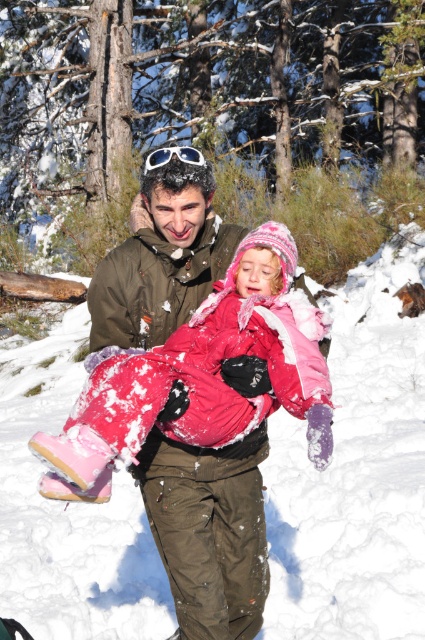
Question: Which of these objects is positioned farthest from the white matte goggles at upper center?

Choices:
 (A) white fluffy snow at center
 (B) fluffy pink snowsuit at center

Answer: (A)

Question: Estimate the real-world distances between objects in this image. Which object is closer to the white matte goggles at upper center?

Choices:
 (A) fluffy pink snowsuit at center
 (B) white fluffy snow at center

Answer: (A)

Question: Is white fluffy snow at center bigger than white matte goggles at upper center?

Choices:
 (A) yes
 (B) no

Answer: (B)

Question: Which of the following is the closest to the observer?

Choices:
 (A) (192, 157)
 (B) (22, 486)

Answer: (A)

Question: Does white fluffy snow at center come behind fluffy pink snowsuit at center?

Choices:
 (A) no
 (B) yes

Answer: (B)

Question: In this image, where is white fluffy snow at center located relative to fluffy pink snowsuit at center?

Choices:
 (A) right
 (B) left

Answer: (B)